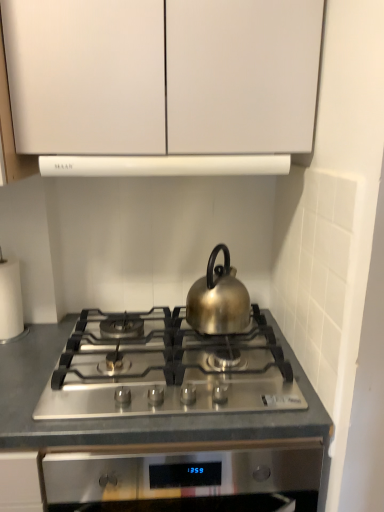
Question: From a real-world perspective, is white matte exhaust hood at upper center above or below white paper at left?

Choices:
 (A) above
 (B) below

Answer: (A)

Question: Considering the positions of white matte exhaust hood at upper center and white paper at left in the image, is white matte exhaust hood at upper center wider or thinner than white paper at left?

Choices:
 (A) wide
 (B) thin

Answer: (A)

Question: Based on their relative distances, which object is farther from the white paper at left?

Choices:
 (A) stainless steel cooktop at center
 (B) shiny metallic kettle at center
 (C) satin silver gas stove at center
 (D) white matte exhaust hood at upper center
 (E) white matte cabinet at upper center

Answer: (E)

Question: Which of these objects is positioned farthest from the white matte exhaust hood at upper center?

Choices:
 (A) white matte cabinet at upper center
 (B) satin silver gas stove at center
 (C) white paper at left
 (D) stainless steel cooktop at center
 (E) shiny metallic kettle at center

Answer: (D)